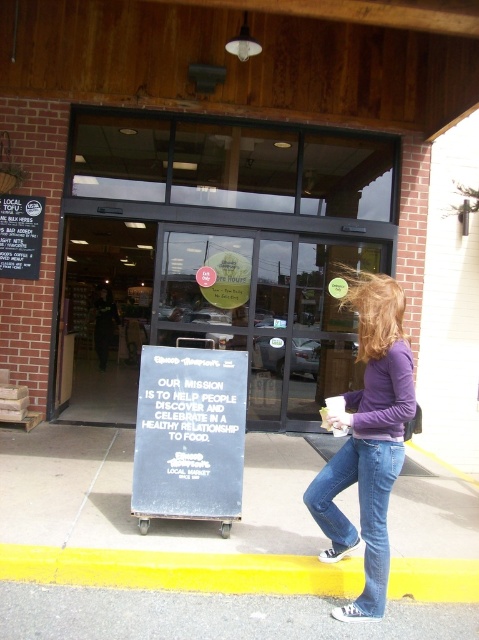
How far apart are clear glass storefront at center and yellow rubber at lower left?

24.06 feet

Does point (102, 152) come closer to viewer compared to point (284, 563)?

No, it is not.

Does point (61, 268) come in front of point (453, 576)?

No, (61, 268) is behind (453, 576).

You are a GUI agent. You are given a task and a screenshot of the screen. Output one action in this format:
    pyautogui.click(x=<x>, y=<y>)
    Task: Click on the clear glass storefront at center
    
    Given the screenshot: What is the action you would take?
    pyautogui.click(x=215, y=256)

Can you confirm if clear glass storefront at center is taller than blue denim jeans at lower center?

Correct, clear glass storefront at center is much taller as blue denim jeans at lower center.

Which is behind, point (204, 289) or point (376, 512)?

Positioned behind is point (204, 289).

The height and width of the screenshot is (640, 479). In order to click on clear glass storefront at center in this screenshot , I will do `click(215, 256)`.

Does clear glass storefront at center appear over yellow asphalt at lower center?

Indeed, clear glass storefront at center is positioned over yellow asphalt at lower center.

Measure the distance between point (254, 244) and camera.

Point (254, 244) and camera are 7.22 meters apart from each other.

Between point (129, 256) and point (226, 547), which one is positioned in front?

Point (226, 547) is more forward.

Identify the location of clear glass storefront at center. (215, 256).